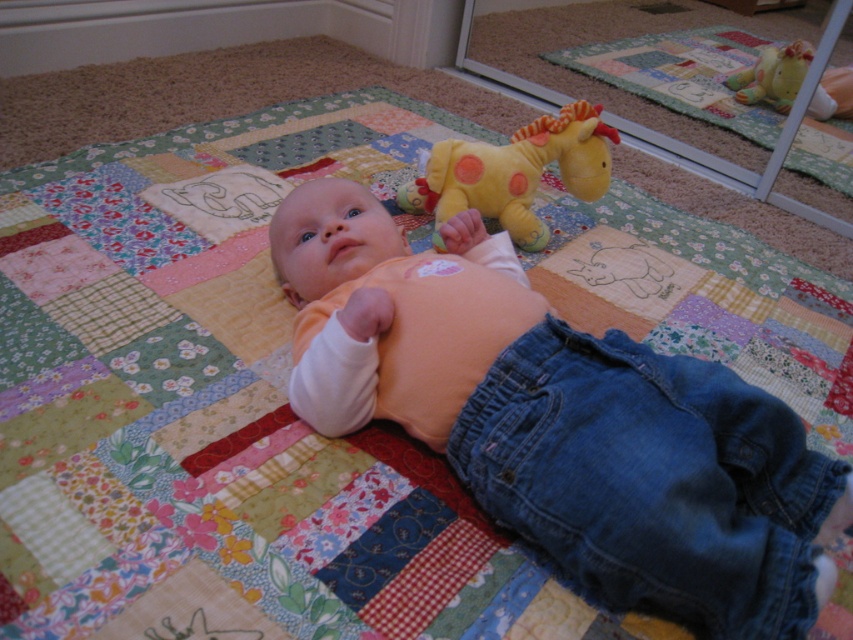
Is matte orange shirt at center below soft yellow plush giraffe at upper center?

Yes.

Between matte orange shirt at center and soft yellow plush giraffe at upper center, which one appears on the right side from the viewer's perspective?

From the viewer's perspective, soft yellow plush giraffe at upper center appears more on the right side.

I want to click on matte orange shirt at center, so click(561, 419).

Image resolution: width=853 pixels, height=640 pixels. I want to click on matte orange shirt at center, so click(x=561, y=419).

Which is in front, point (546, 138) or point (799, 51)?

Point (546, 138) is in front.

Is soft yellow plush giraffe at upper center smaller than yellow plush giraffe at upper center?

No, soft yellow plush giraffe at upper center is not smaller than yellow plush giraffe at upper center.

What are the coordinates of `soft yellow plush giraffe at upper center` in the screenshot? It's located at (514, 172).

Can you confirm if matte orange shirt at center is wider than yellow plush giraffe at upper center?

Yes.

Who is more distant from viewer, (579,342) or (776,109)?

Positioned behind is point (776,109).

Where is `matte orange shirt at center`? The height and width of the screenshot is (640, 853). matte orange shirt at center is located at coordinates (561, 419).